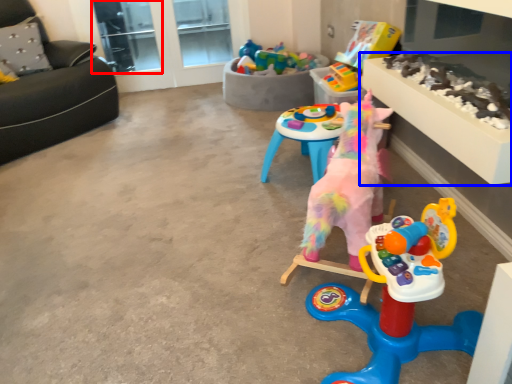
Question: Among these objects, which one is nearest to the camera, glass door (highlighted by a red box) or table (highlighted by a blue box)?

Choices:
 (A) glass door
 (B) table

Answer: (B)